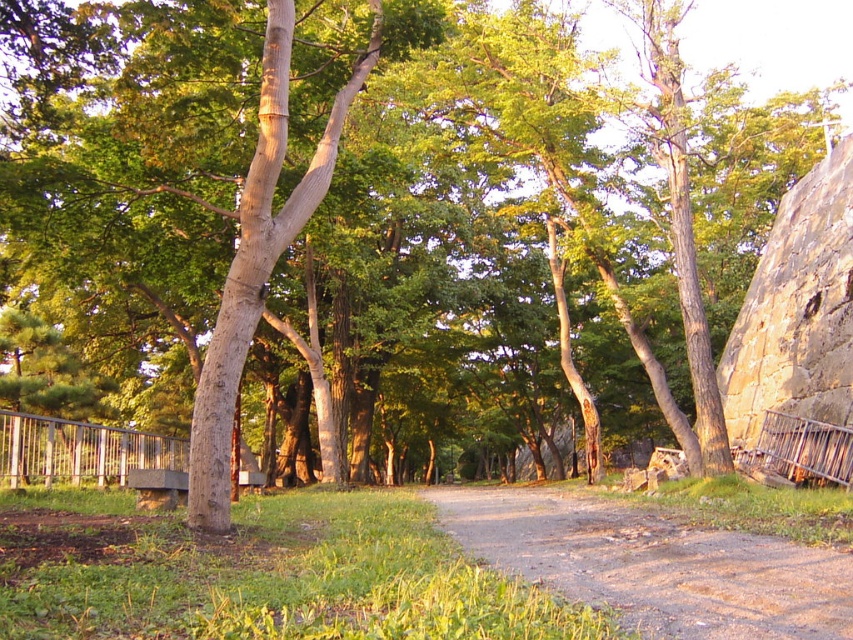
How much distance is there between rusty metal fence at right and metallic silver rail at right?

The distance of rusty metal fence at right from metallic silver rail at right is 8.18 feet.

Measure the distance between rusty metal fence at right and camera.

rusty metal fence at right and camera are 13.66 meters apart.

Does point (763, 458) lie in front of point (758, 435)?

Yes, it is in front of point (758, 435).

I want to click on rusty metal fence at right, so click(798, 337).

Which is in front, point (167, 461) or point (846, 445)?

Point (846, 445)

Between silver metallic rail at lower left and metallic silver rail at right, which one appears on the right side from the viewer's perspective?

metallic silver rail at right is more to the right.

Locate an element on the screen. silver metallic rail at lower left is located at coordinates (80, 451).

Is brown gravel path at center shorter than silver metallic rail at lower left?

Incorrect, brown gravel path at center's height does not fall short of silver metallic rail at lower left's.

Is brown gravel path at center to the right of silver metallic rail at lower left from the viewer's perspective?

Indeed, brown gravel path at center is positioned on the right side of silver metallic rail at lower left.

Where is `brown gravel path at center`? brown gravel path at center is located at coordinates (654, 564).

Locate an element on the screen. The image size is (853, 640). brown gravel path at center is located at coordinates (654, 564).